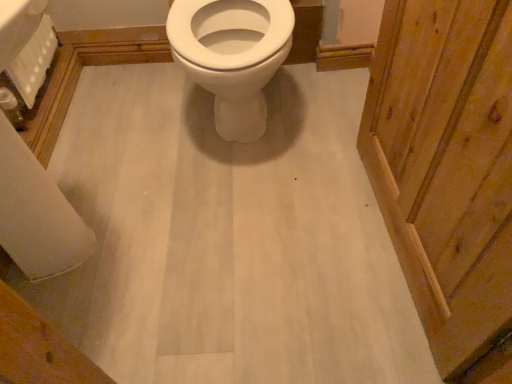
Question: Is white textured toilet paper at upper left, which appears as the 2th toilet paper when viewed from the right, wider or thinner than white matte toilet paper at lower left, the second toilet paper viewed from the left?

Choices:
 (A) wide
 (B) thin

Answer: (A)

Question: Considering the positions of white textured toilet paper at upper left, the 1th toilet paper positioned from the left, and white matte toilet paper at lower left, the second toilet paper viewed from the left, in the image, is white textured toilet paper at upper left, the 1th toilet paper positioned from the left, taller or shorter than white matte toilet paper at lower left, the second toilet paper viewed from the left,?

Choices:
 (A) tall
 (B) short

Answer: (A)

Question: Based on their relative distances, which object is nearer to the white matte toilet paper at lower left, which is counted as the 1th toilet paper, starting from the right?

Choices:
 (A) white glossy toilet at center
 (B) white textured toilet paper at upper left, which appears as the 2th toilet paper when viewed from the right

Answer: (B)

Question: Considering the real-world distances, which object is closest to the white textured toilet paper at upper left, the 1th toilet paper positioned from the left?

Choices:
 (A) white matte toilet paper at lower left, the second toilet paper viewed from the left
 (B) white glossy toilet at center

Answer: (A)